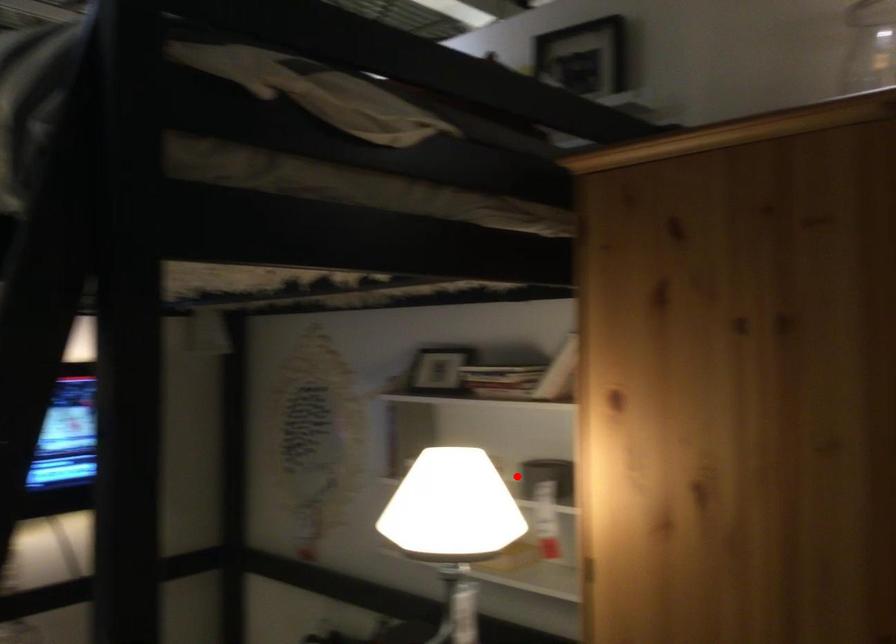
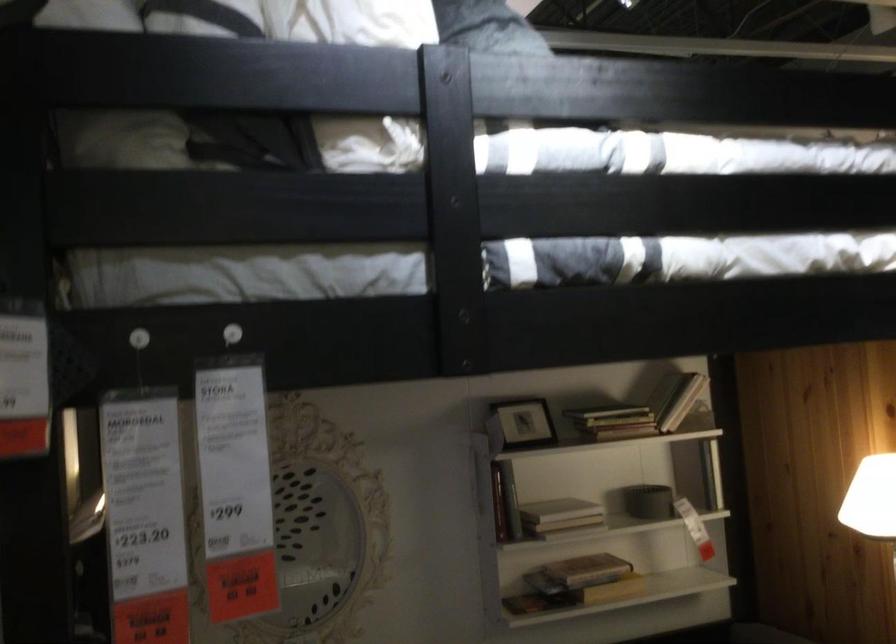
Locate, in the second image, the point that corresponds to the highlighted location in the first image.

(648, 502)